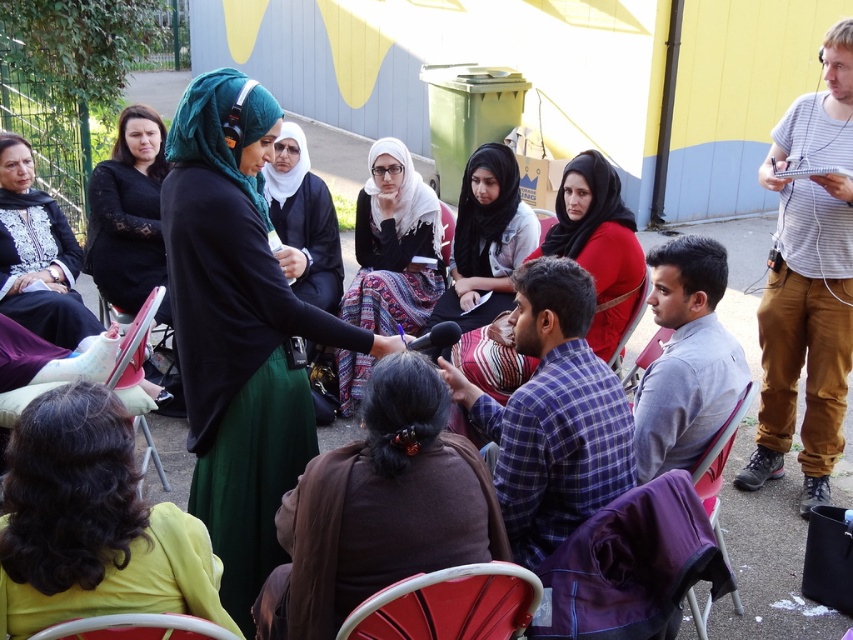
You are organizing a small event and need to place a decorative tablecloth on the pink fabric chair at lower right. The tablecloth you have is the same size as the brown fabric at center. Will the tablecloth fit the chair?

The brown fabric at center is wider than the pink fabric chair at lower right. Since the tablecloth is the same size as the brown fabric at center, it will be too wide for the pink fabric chair at lower right.

Consider the image. You are standing at the center of the scene and want to locate the curly hair at lower left. Which direction should you face to look directly at it?

Since the curly hair at lower left is located at point 0.819 on the x axis and 0.108 on the y axis, you should face towards the lower left direction to look directly at it.